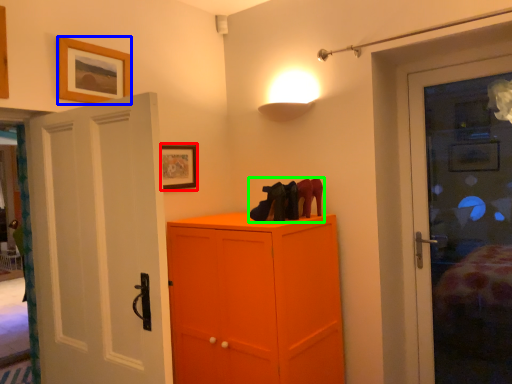
Question: Estimate the real-world distances between objects in this image. Which object is farther from picture frame (highlighted by a red box), picture frame (highlighted by a blue box) or footwear (highlighted by a green box)?

Choices:
 (A) picture frame
 (B) footwear

Answer: (B)